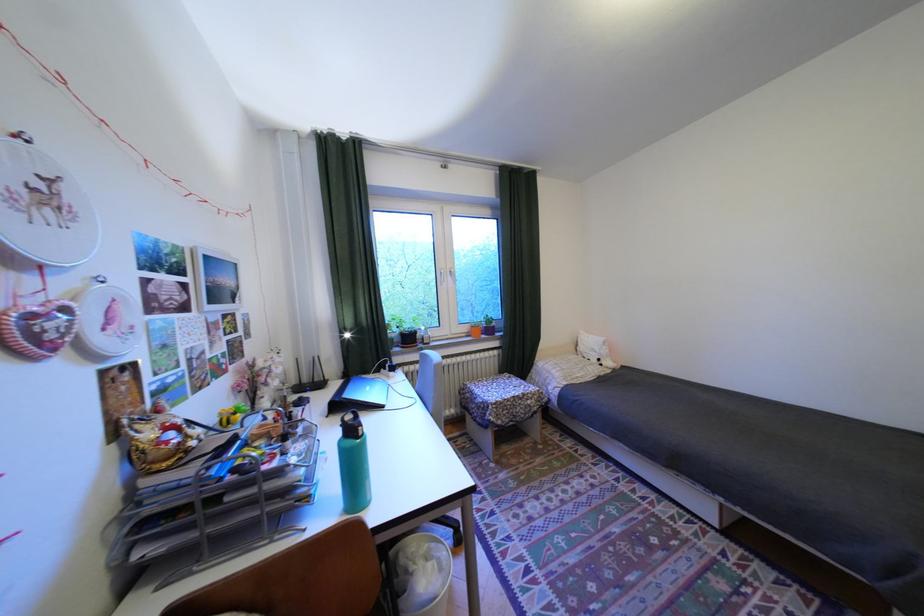
Identify the location of small patterned stool. This screenshot has height=616, width=924. (500, 408).